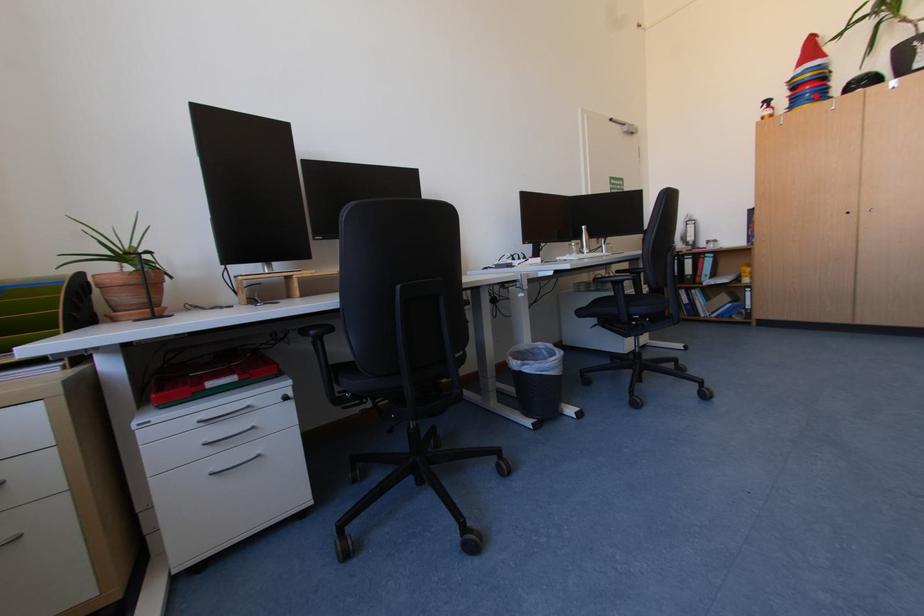
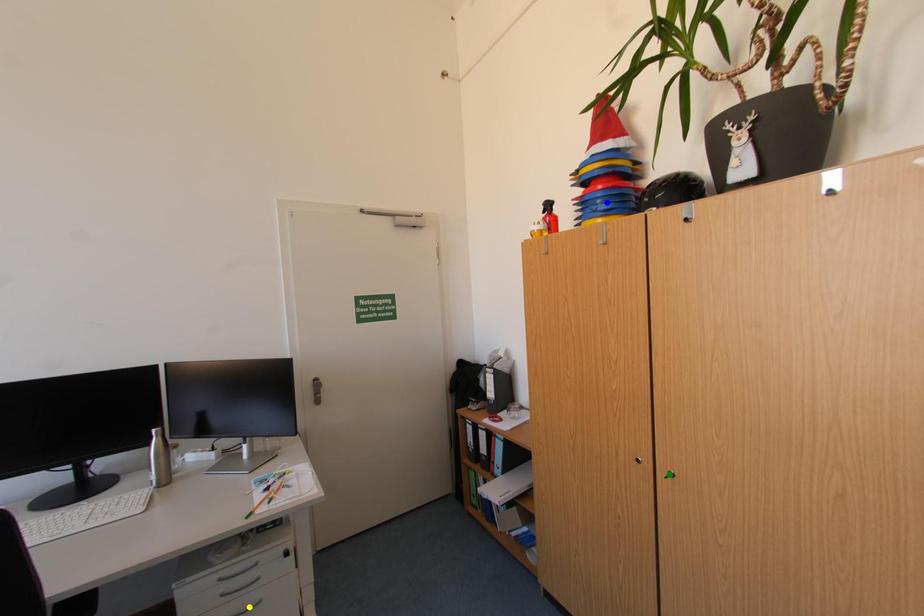
Question: I am providing you with two images of the same scene from different viewpoints. A red point is marked on the first image. You are given multiple points on the second image. Which point in image 2 is actually the same real-world point as the red point in image 1?

Choices:
 (A) yellow point
 (B) green point
 (C) blue point

Answer: (C)